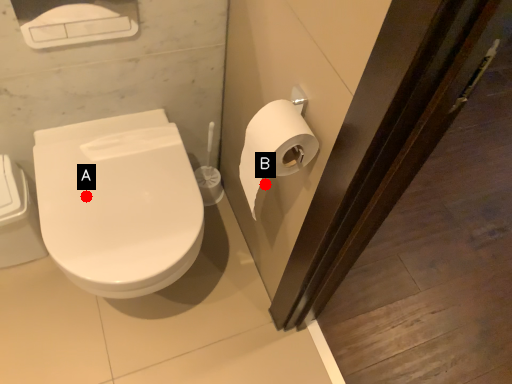
Question: Two points are circled on the image, labeled by A and B beside each circle. Which point is closer to the camera?

Choices:
 (A) A is closer
 (B) B is closer

Answer: (A)